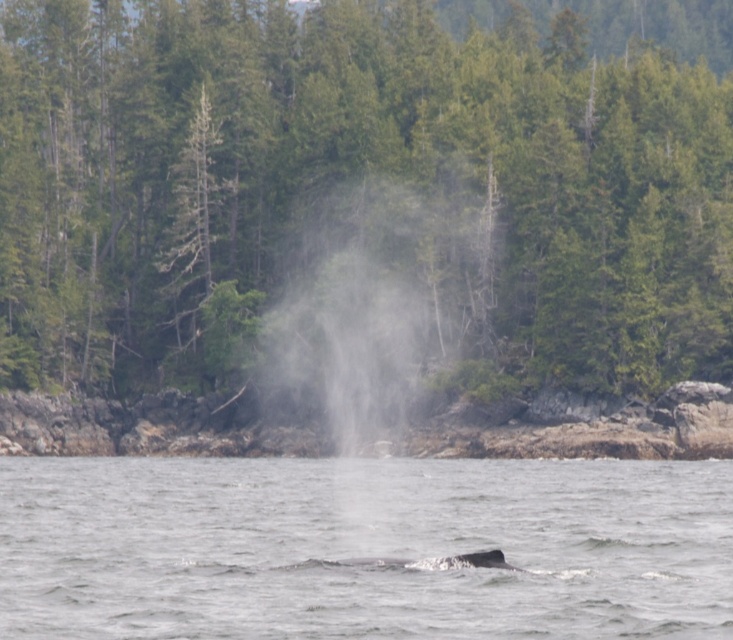
Question: Based on their relative distances, which object is nearer to the gray water at center?

Choices:
 (A) gray spotted whale at lower center
 (B) green leafy tree at center

Answer: (B)

Question: Does green leafy tree at center appear on the left side of gray spotted whale at lower center?

Choices:
 (A) yes
 (B) no

Answer: (B)

Question: Can you confirm if green leafy tree at center is smaller than gray water at center?

Choices:
 (A) yes
 (B) no

Answer: (B)

Question: Among these objects, which one is farthest from the camera?

Choices:
 (A) gray water at center
 (B) gray spotted whale at lower center

Answer: (B)

Question: Which of these objects is positioned farthest from the green leafy tree at center?

Choices:
 (A) gray water at center
 (B) gray spotted whale at lower center

Answer: (B)

Question: Does gray water at center lie in front of gray spotted whale at lower center?

Choices:
 (A) yes
 (B) no

Answer: (A)